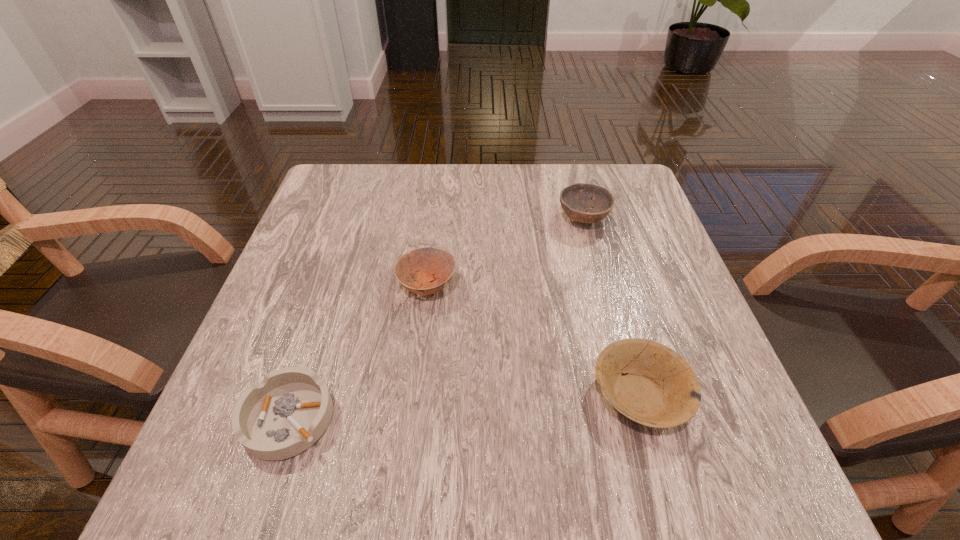
In the image, there is a desktop. At what (x,y) coordinates should I click in order to perform the action: click on vacant space at the right edge. Please return your answer as a coordinate pair (x, y). The height and width of the screenshot is (540, 960). Looking at the image, I should click on (592, 224).

Locate an element on the screen. free space at the far right corner of the desktop is located at coordinates (636, 207).

The width and height of the screenshot is (960, 540). I want to click on vacant area at the near right corner, so click(735, 500).

The image size is (960, 540). Identify the location of free space between the leftmost bowl and the ashtray. (358, 352).

Find the location of `vacant region between the farthest bowl and the third nearest object`. vacant region between the farthest bowl and the third nearest object is located at coordinates (505, 252).

Where is `vacant space that's between the leftmost object and the second farthest object`? The height and width of the screenshot is (540, 960). vacant space that's between the leftmost object and the second farthest object is located at coordinates (358, 352).

Where is `free spot between the nearest bowl and the farthest object`? The image size is (960, 540). free spot between the nearest bowl and the farthest object is located at coordinates (612, 307).

Find the location of a particular element. This screenshot has height=540, width=960. vacant region between the second farthest bowl and the shortest object is located at coordinates point(358,352).

Where is `unoccupied area between the nearest bowl and the farthest object`? unoccupied area between the nearest bowl and the farthest object is located at coordinates (612, 307).

The height and width of the screenshot is (540, 960). Find the location of `free space between the shortest object and the second nearest bowl`. free space between the shortest object and the second nearest bowl is located at coordinates (358, 352).